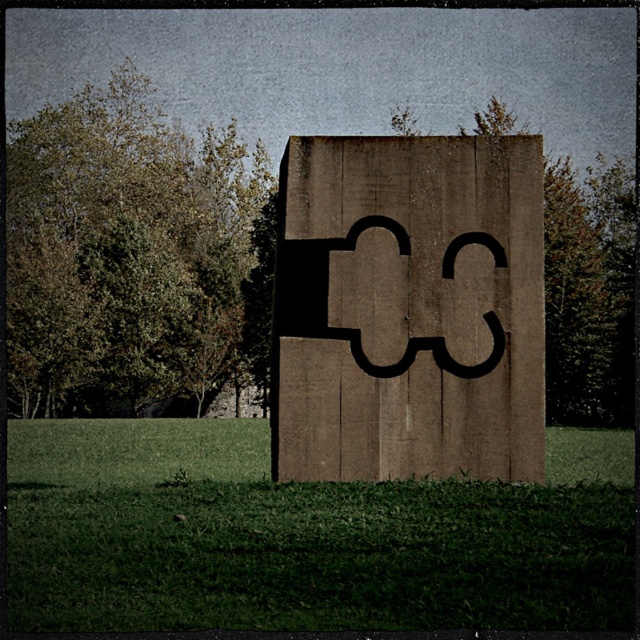
Question: Is green grass at center to the right of brown concrete sign at center from the viewer's perspective?

Choices:
 (A) no
 (B) yes

Answer: (B)

Question: Which of the following is the closest to the observer?

Choices:
 (A) (161, 616)
 (B) (276, 362)
 (C) (332, 332)

Answer: (A)

Question: Is green grass at center thinner than black concrete number at center?

Choices:
 (A) no
 (B) yes

Answer: (A)

Question: Is brown concrete sign at center to the left of black concrete number at center from the viewer's perspective?

Choices:
 (A) yes
 (B) no

Answer: (B)

Question: Estimate the real-world distances between objects in this image. Which object is farther from the green grass at center?

Choices:
 (A) black concrete number at center
 (B) brown concrete sign at center

Answer: (A)

Question: Which point appears farthest from the camera in this image?

Choices:
 (A) (529, 396)
 (B) (90, 460)
 (C) (369, 216)

Answer: (B)